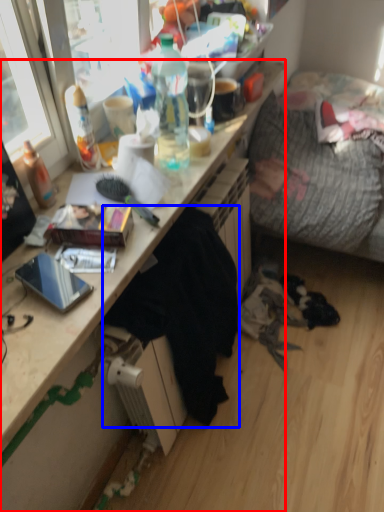
Question: Among these objects, which one is farthest to the camera, desk (highlighted by a red box) or clothing (highlighted by a blue box)?

Choices:
 (A) desk
 (B) clothing

Answer: (B)